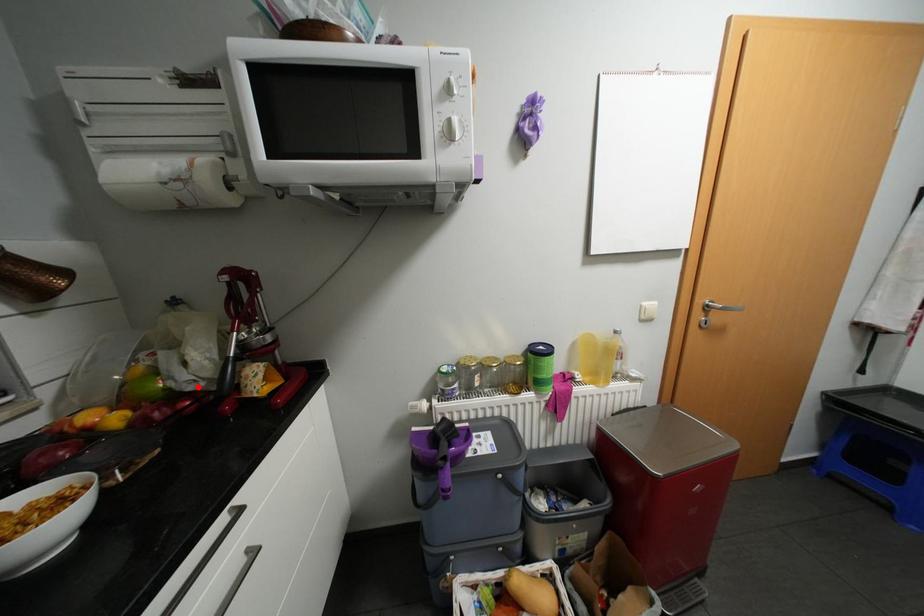
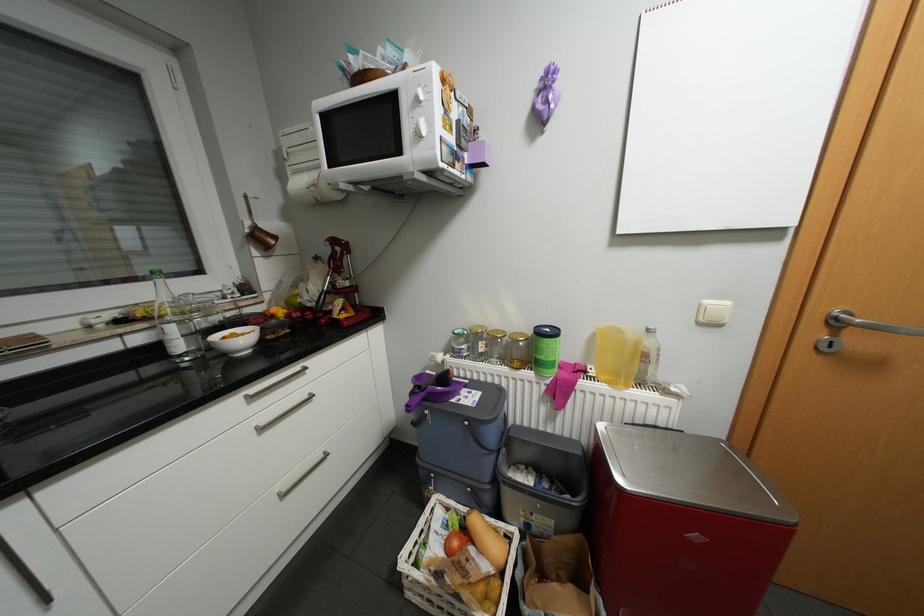
Locate, in the second image, the point that corresponds to the highlighted location in the first image.

(317, 304)